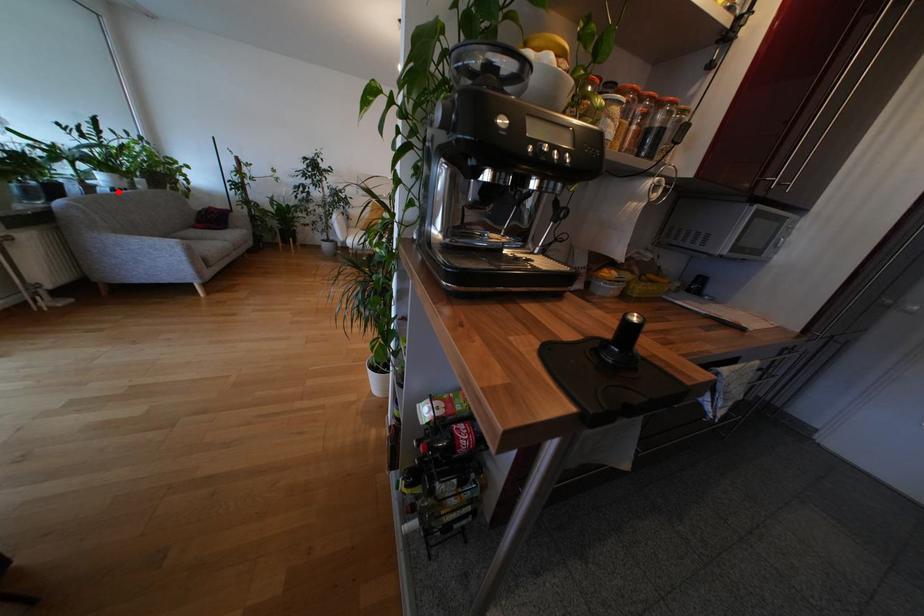
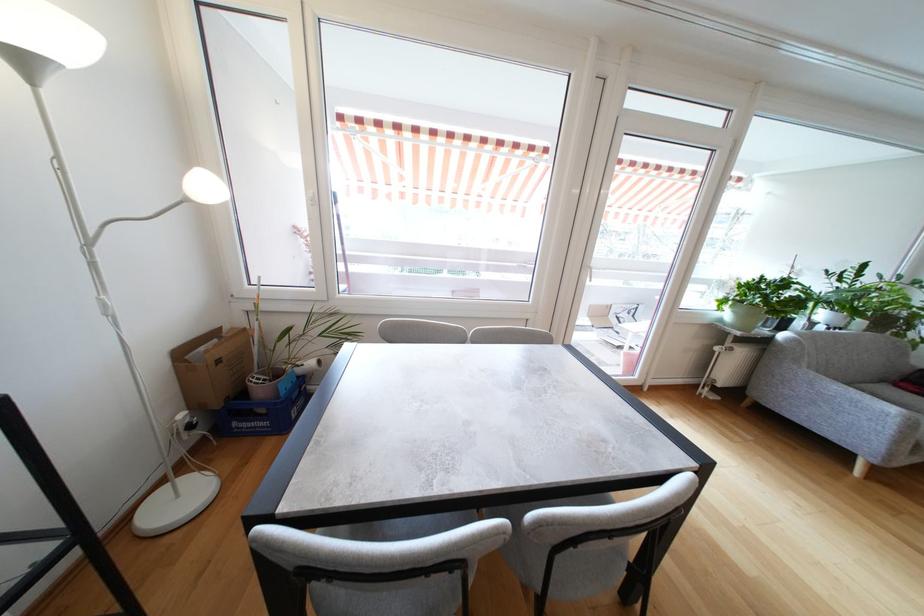
Locate, in the second image, the point that corresponds to the highlighted location in the first image.

(833, 330)